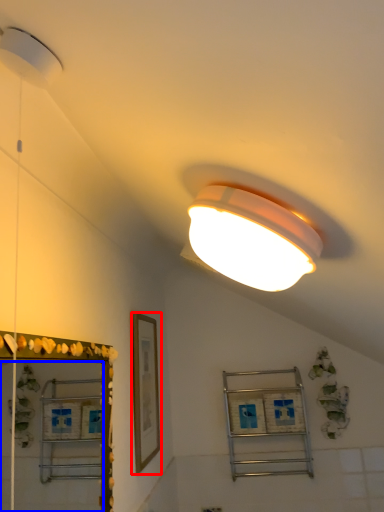
Question: Which object is closer to the camera taking this photo, picture frame (highlighted by a red box) or mirror (highlighted by a blue box)?

Choices:
 (A) picture frame
 (B) mirror

Answer: (B)